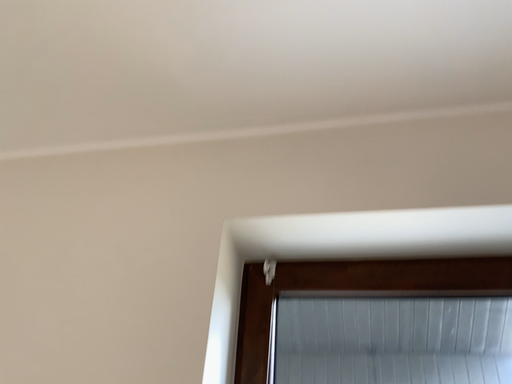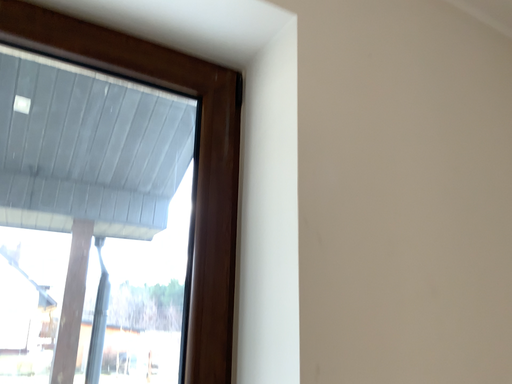
Question: How did the camera likely rotate when shooting the video?

Choices:
 (A) rotated downward
 (B) rotated upward

Answer: (A)